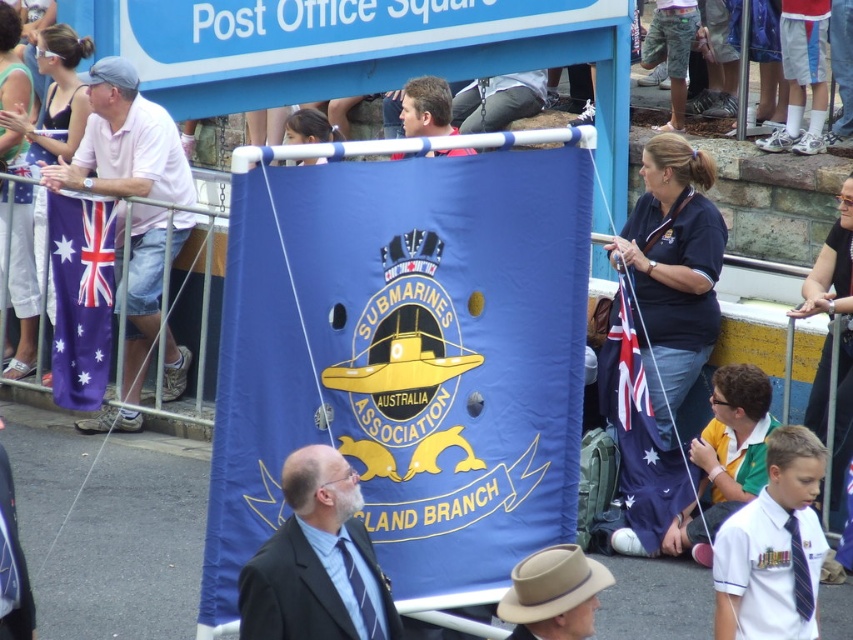
Question: Which is farther from the white cotton shirt at left?

Choices:
 (A) smooth brown hair at center
 (B) blue fabric flag at center

Answer: (B)

Question: In this image, where is silky purple flag at left located relative to blue fabric flag at center?

Choices:
 (A) right
 (B) left

Answer: (B)

Question: Which of the following is the farthest from the observer?

Choices:
 (A) (614, 429)
 (B) (432, 77)

Answer: (B)

Question: Does white cotton shirt at left have a lesser width compared to blue fabric flag at lower right?

Choices:
 (A) no
 (B) yes

Answer: (A)

Question: Does white cotton shirt at left have a lesser width compared to smooth brown hair at center?

Choices:
 (A) yes
 (B) no

Answer: (B)

Question: Which point is farther from the camera taking this photo?

Choices:
 (A) (637, 499)
 (B) (82, 362)

Answer: (B)